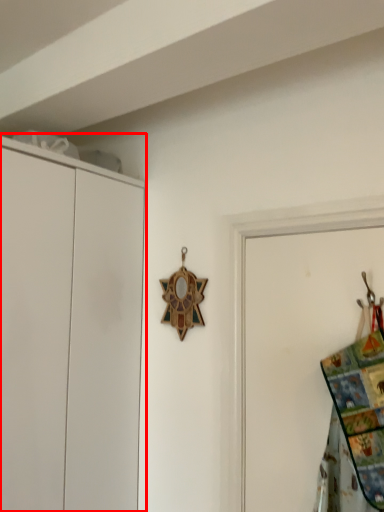
Question: From the image, what is the correct spatial relationship of cupboard (annotated by the red box) in relation to blanket?

Choices:
 (A) left
 (B) right

Answer: (A)